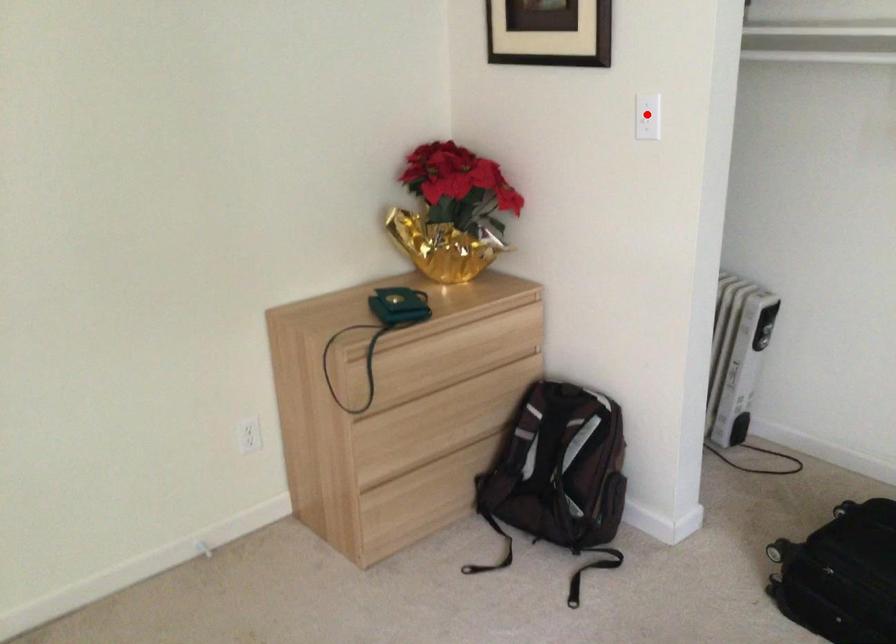
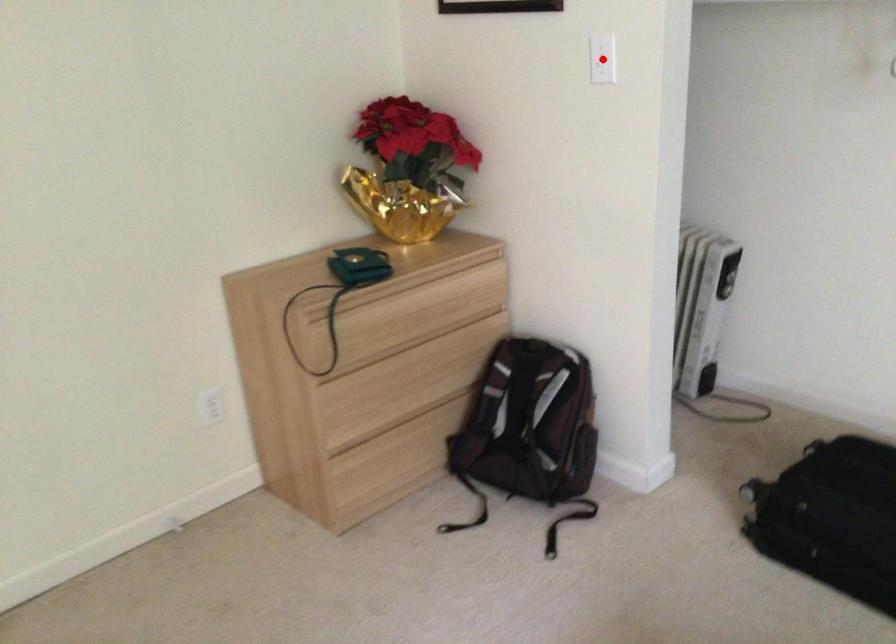
I am providing you with two images of the same scene from different viewpoints. A red point is marked on the first image and another point is marked on the second image. Are the points marked in image1 and image2 representing the same 3D position?

Yes